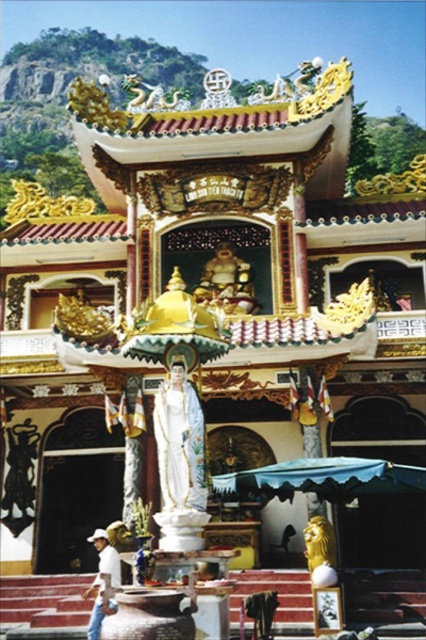
You are a visitor at the temple and want to take a photo of the white glossy statue at center without the white cotton shirt at lower left appearing in the frame. Is this possible based on their sizes?

The white glossy statue at center occupies less space than the white cotton shirt at lower left, so it might be challenging to avoid the white cotton shirt at lower left in the photo if they are both within the camera frame. Adjust your position to ensure only the smaller statue is captured.

You are an architect visiting the temple and want to take a photo of the white glossy statue at center without the white cotton shirt at lower left appearing in the background. Is this possible based on their positions?

The white glossy statue at center is in front of the white cotton shirt at lower left, so yes, you can take a photo of the white glossy statue at center without the white cotton shirt at lower left in the background by positioning yourself so the statue blocks the view of the shirt.

You are a temple visitor who wants to take a photo of both the white glossy statue at center and the gold polished statue at center. If your camera can focus on objects within 100 feet, will both statues be in focus at the same time?

The white glossy statue at center is 76.84 feet from gold polished statue at center. Since the distance between them is within the camera focus range of 100 feet, both statues can be in focus simultaneously.